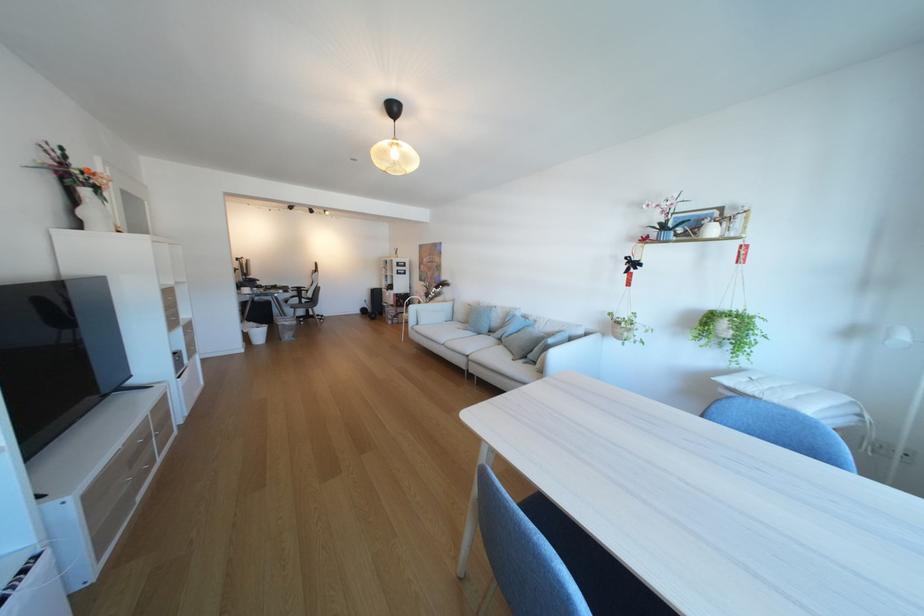
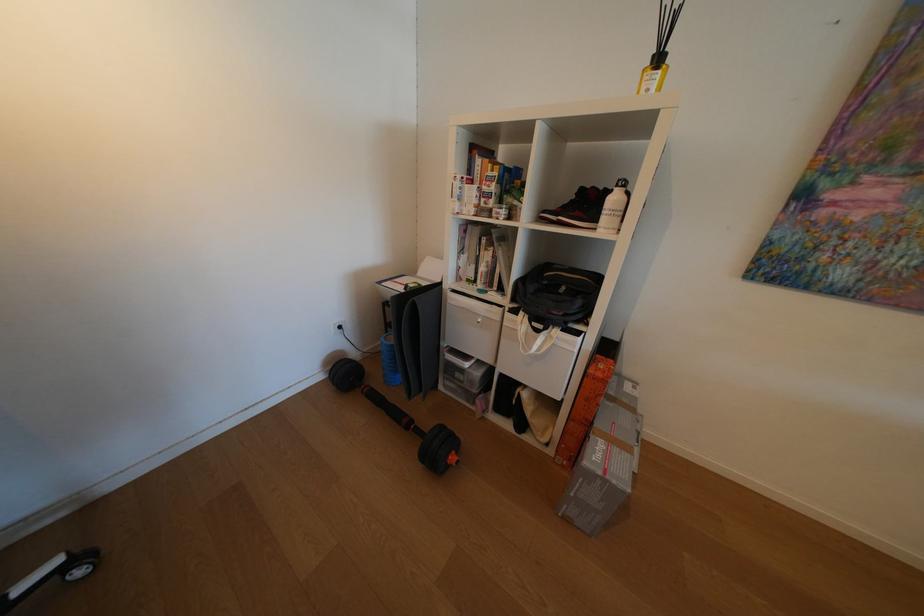
Locate, in the second image, the point that corresponds to (x=398, y=292) in the first image.

(548, 331)